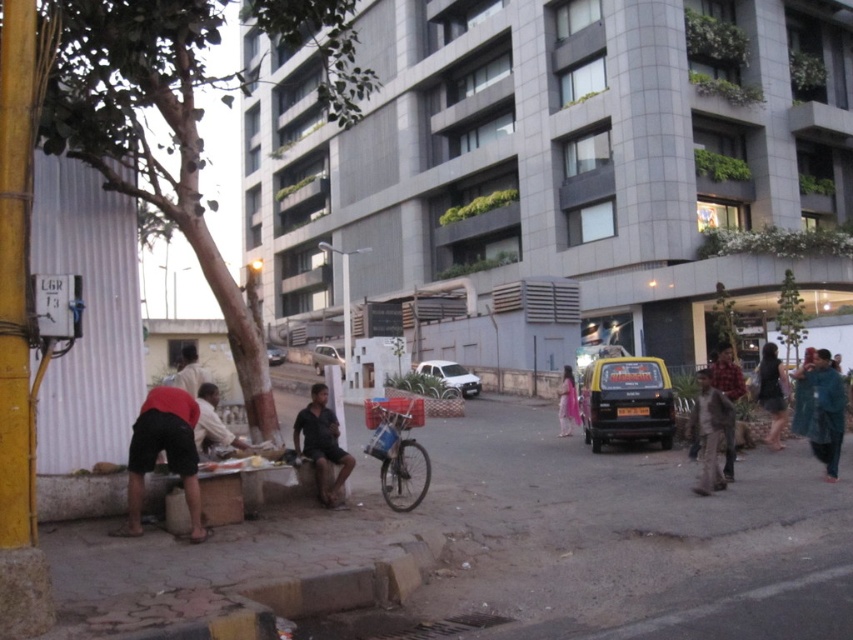
Question: Is brown concrete curb at lower center wider than metallic silver bicycle at center?

Choices:
 (A) yes
 (B) no

Answer: (B)

Question: Is dark blue shirt at center smaller than silver metallic van at center?

Choices:
 (A) no
 (B) yes

Answer: (A)

Question: Among these points, which one is nearest to the camera?

Choices:
 (A) (804, 317)
 (B) (138, 496)
 (C) (825, 388)

Answer: (B)

Question: Which point is farther from the camera taking this photo?

Choices:
 (A) (155, 634)
 (B) (560, 413)

Answer: (B)

Question: Among these objects, which one is farthest from the camera?

Choices:
 (A) green bark tree at left
 (B) brown concrete curb at lower center
 (C) blue fabric at right
 (D) light brown shirt at center

Answer: (C)

Question: Does blue fabric at right have a smaller size compared to metallic silver car at center?

Choices:
 (A) no
 (B) yes

Answer: (B)